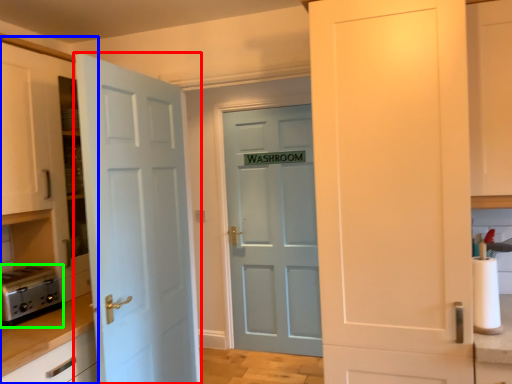
Question: Based on their relative distances, which object is nearer to door (highlighted by a red box)? Choose from dresser (highlighted by a blue box) and appliance (highlighted by a green box).

Choices:
 (A) dresser
 (B) appliance

Answer: (A)